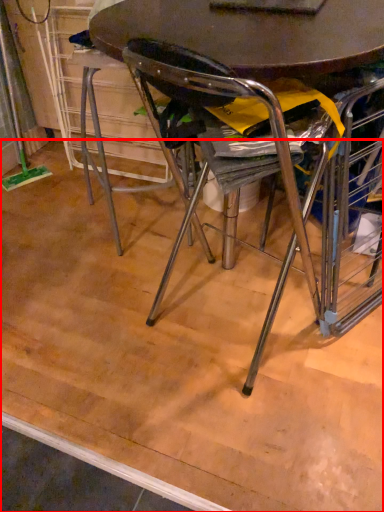
Question: Considering the relative positions of plywood (annotated by the red box) and table in the image provided, where is plywood (annotated by the red box) located with respect to the staircase?

Choices:
 (A) right
 (B) left

Answer: (B)